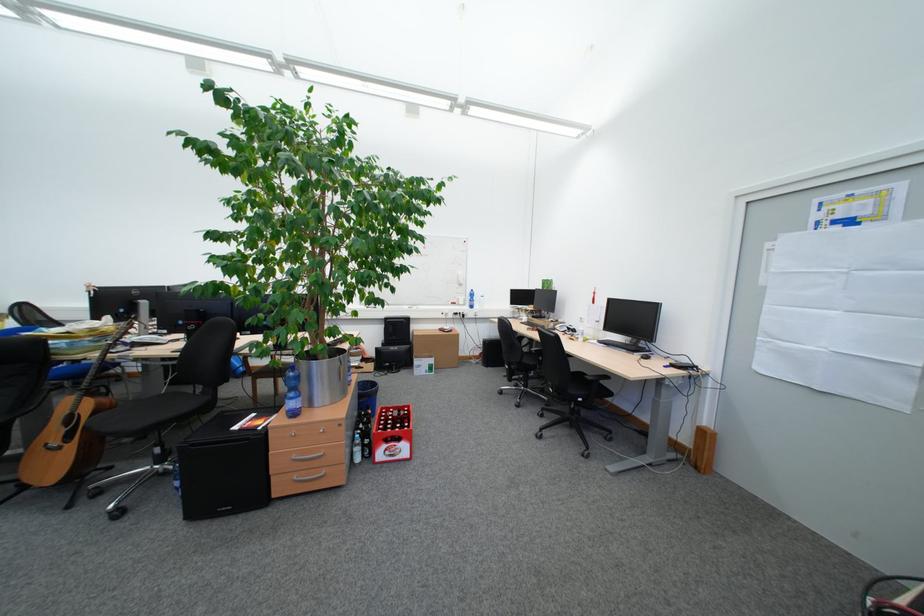
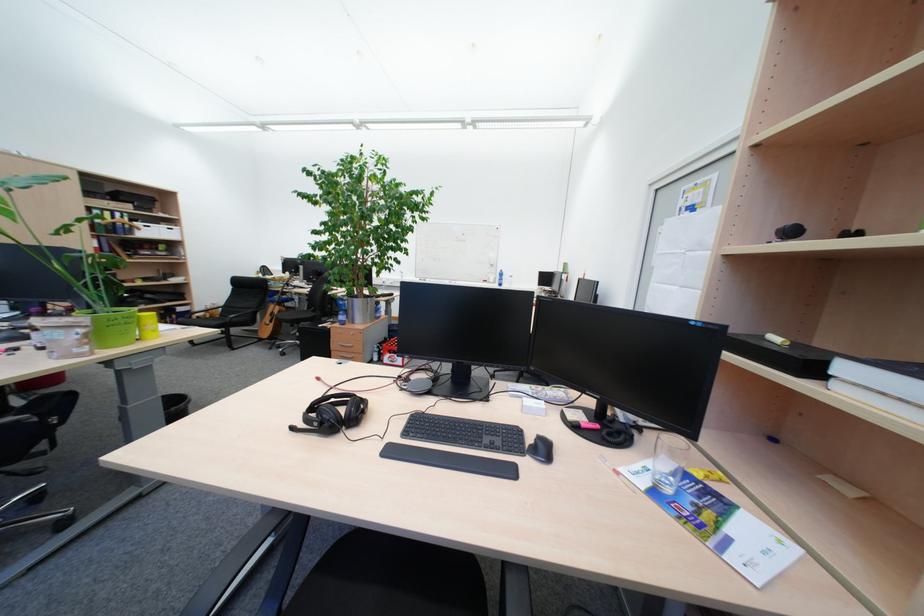
In a continuous first-person perspective shot, in which direction is the camera moving?

The movement direction of the cameraman is right, backward.